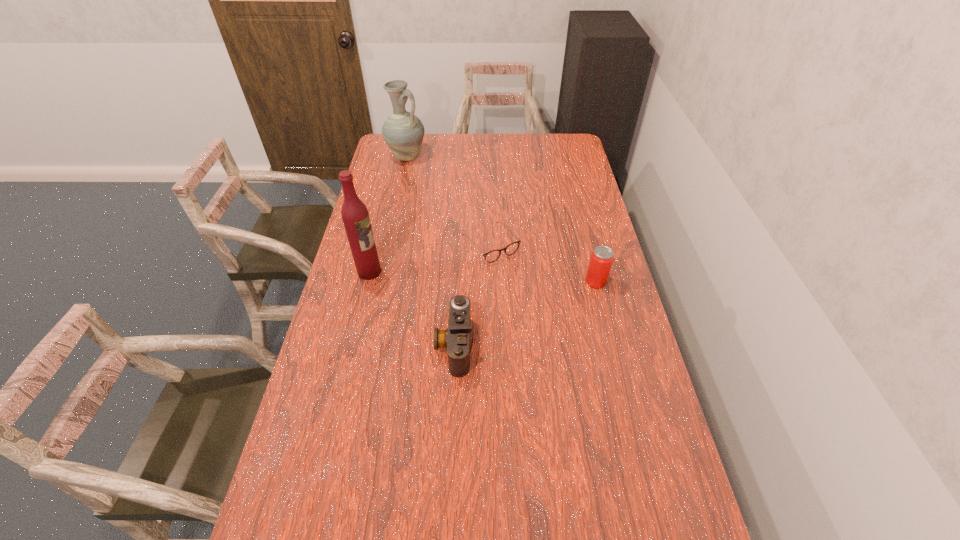
Identify the location of vacant region located 0.260m on the lens of the second shortest object. The image size is (960, 540). (348, 345).

This screenshot has width=960, height=540. Identify the location of vacant space positioned on the front of the can. (613, 350).

Identify the location of blank space located 0.250m through the lenses of the shortest object. This screenshot has height=540, width=960. (547, 311).

This screenshot has height=540, width=960. Identify the location of free region located 0.380m through the lenses of the shortest object. (573, 340).

Image resolution: width=960 pixels, height=540 pixels. Identify the location of vacant space situated through the lenses of the shortest object. click(x=553, y=318).

Where is `vacant region located 0.250m on the handle side of the second tallest object`? The image size is (960, 540). vacant region located 0.250m on the handle side of the second tallest object is located at coordinates (441, 195).

Locate an element on the screen. Image resolution: width=960 pixels, height=540 pixels. vacant point located 0.400m on the handle side of the second tallest object is located at coordinates coord(459,214).

Find the location of a particular element. The image size is (960, 540). vacant area located 0.260m on the handle side of the second tallest object is located at coordinates (443, 196).

Identify the location of vacant space located on the label of the liquor. This screenshot has height=540, width=960. (419, 281).

Where is `vacant point located 0.300m on the label of the liquor`? The width and height of the screenshot is (960, 540). vacant point located 0.300m on the label of the liquor is located at coordinates (465, 291).